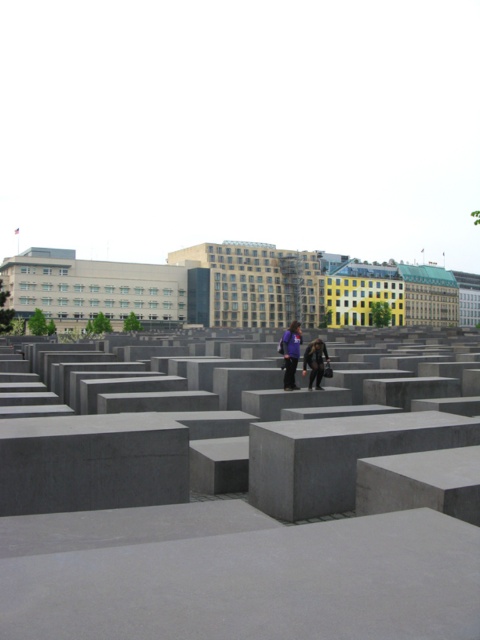
Is purple fabric jacket at center closer to camera compared to dark gray concrete blocks at center?

No, it is behind dark gray concrete blocks at center.

Can you confirm if purple fabric jacket at center is shorter than dark gray concrete blocks at center?

No.

The height and width of the screenshot is (640, 480). What are the coordinates of `purple fabric jacket at center` in the screenshot? It's located at click(x=290, y=353).

Is point (266, 632) positioned after point (288, 352)?

No, (266, 632) is closer to viewer.

Which is behind, point (335, 451) or point (292, 372)?

The point (292, 372) is more distant.

Is point (168, 547) behind point (292, 344)?

No.

This screenshot has width=480, height=640. In order to click on gray concrete blocks at center in this screenshot , I will do `click(245, 518)`.

Can you confirm if gray concrete blocks at center is taller than dark gray concrete blocks at center?

Indeed, gray concrete blocks at center has a greater height compared to dark gray concrete blocks at center.

Is point (28, 442) less distant than point (323, 355)?

Yes.

You are a GUI agent. You are given a task and a screenshot of the screen. Output one action in this format:
    pyautogui.click(x=<x>, y=<y>)
    Task: Click on the gray concrete blocks at center
    This screenshot has width=480, height=640.
    Given the screenshot: What is the action you would take?
    pyautogui.click(x=245, y=518)